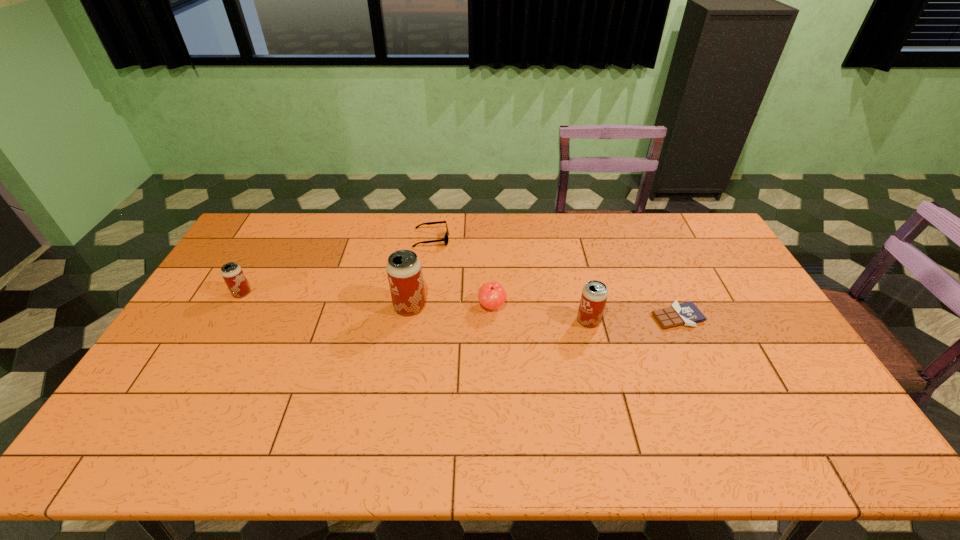
The image size is (960, 540). Identify the location of free space at the far edge of the desktop. (455, 226).

In the image, there is a desktop. At what (x,y) coordinates should I click in order to perform the action: click on blank space at the near edge. Please return your answer as a coordinate pair (x, y). Image resolution: width=960 pixels, height=540 pixels. Looking at the image, I should click on (608, 387).

Where is `vacant space at the left edge of the desktop`? The width and height of the screenshot is (960, 540). vacant space at the left edge of the desktop is located at coordinates (199, 310).

The width and height of the screenshot is (960, 540). I want to click on vacant space at the right edge, so click(751, 304).

The width and height of the screenshot is (960, 540). In the image, there is a desktop. In order to click on vacant space at the far left corner in this screenshot , I will do [x=274, y=238].

Identify the location of free area in between the second object from right to left and the farthest object. (510, 280).

At what (x,y) coordinates should I click in order to perform the action: click on vacant region between the farthest object and the fourth shortest object. Please return your answer as a coordinate pair (x, y). The height and width of the screenshot is (540, 960). Looking at the image, I should click on (337, 266).

Identify the location of free spot between the tallest beer can and the fifth object from left to right. (499, 314).

Where is `free space between the tallest object and the leftmost object`? This screenshot has height=540, width=960. free space between the tallest object and the leftmost object is located at coordinates (325, 300).

I want to click on empty space between the second shortest beer can and the tallest object, so click(499, 314).